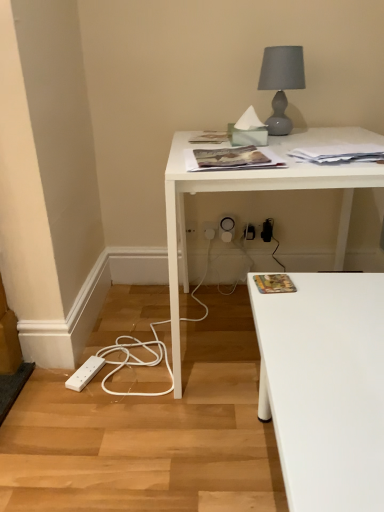
Where is `free spot in front of white plastic extension cord at lower left`? This screenshot has height=512, width=384. free spot in front of white plastic extension cord at lower left is located at coordinates (81, 410).